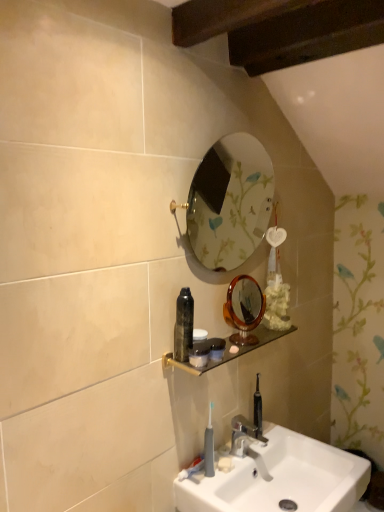
Where is `free space underneath wooden shelf at center (from a real-world perspective)`? free space underneath wooden shelf at center (from a real-world perspective) is located at coordinates (240, 453).